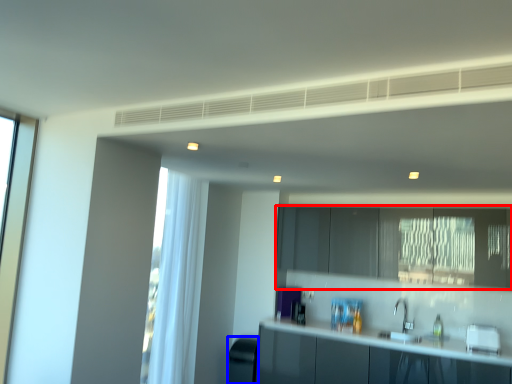
Question: Which point is further to the camera, cabinetry (highlighted by a red box) or appliance (highlighted by a blue box)?

Choices:
 (A) cabinetry
 (B) appliance

Answer: (B)